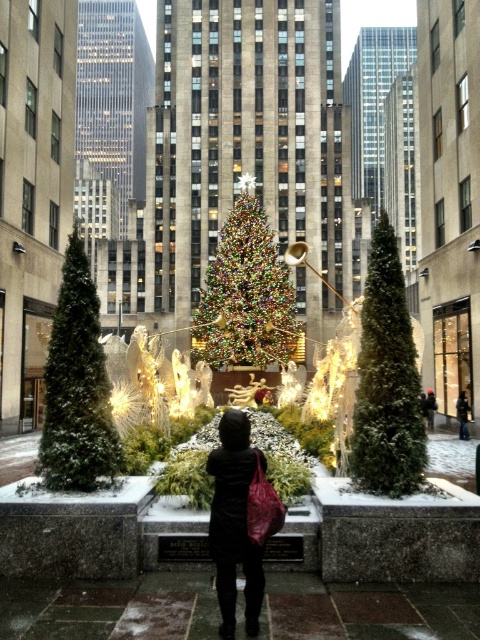
Question: Can you confirm if green textured christmas tree at left is smaller than shiny multicolored tree at center?

Choices:
 (A) no
 (B) yes

Answer: (B)

Question: Which point appears farthest from the camera in this image?

Choices:
 (A) (463, 420)
 (B) (430, 410)
 (C) (233, 464)

Answer: (B)

Question: Which object is farther from the camera taking this photo?

Choices:
 (A) green textured christmas tree at left
 (B) black leather jacket at center
 (C) black matte coat at center

Answer: (B)

Question: Is shiny multicolored tree at center below orange knit hat at center?

Choices:
 (A) no
 (B) yes

Answer: (A)

Question: Observing the image, what is the correct spatial positioning of green textured pine tree at center in reference to orange knit hat at center?

Choices:
 (A) above
 (B) below

Answer: (A)

Question: Among these points, which one is nearest to the camera?

Choices:
 (A) (264, 300)
 (B) (217, 593)

Answer: (B)